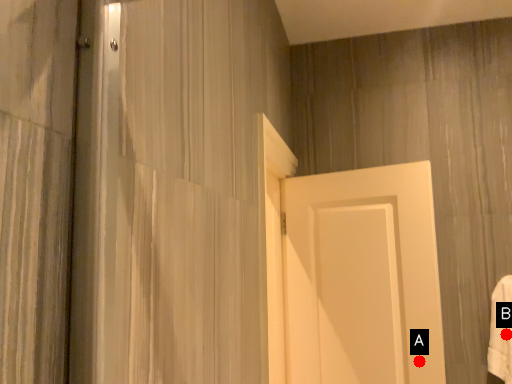
Question: Two points are circled on the image, labeled by A and B beside each circle. Which point appears closest to the camera in this image?

Choices:
 (A) A is closer
 (B) B is closer

Answer: (A)